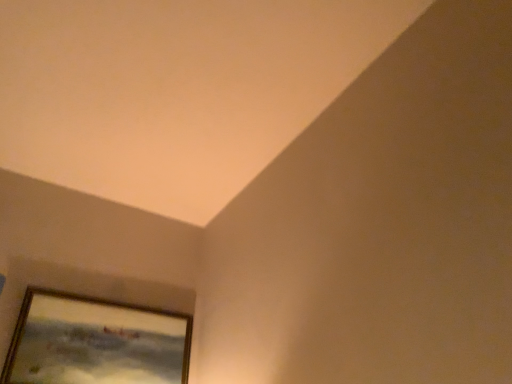
This screenshot has height=384, width=512. What do you see at coordinates (96, 342) in the screenshot?
I see `wooden framed painting at lower left` at bounding box center [96, 342].

Locate an element on the screen. wooden framed painting at lower left is located at coordinates (96, 342).

At what (x,y) coordinates should I click in order to perform the action: click on wooden framed painting at lower left. Please return your answer as a coordinate pair (x, y). Looking at the image, I should click on tap(96, 342).